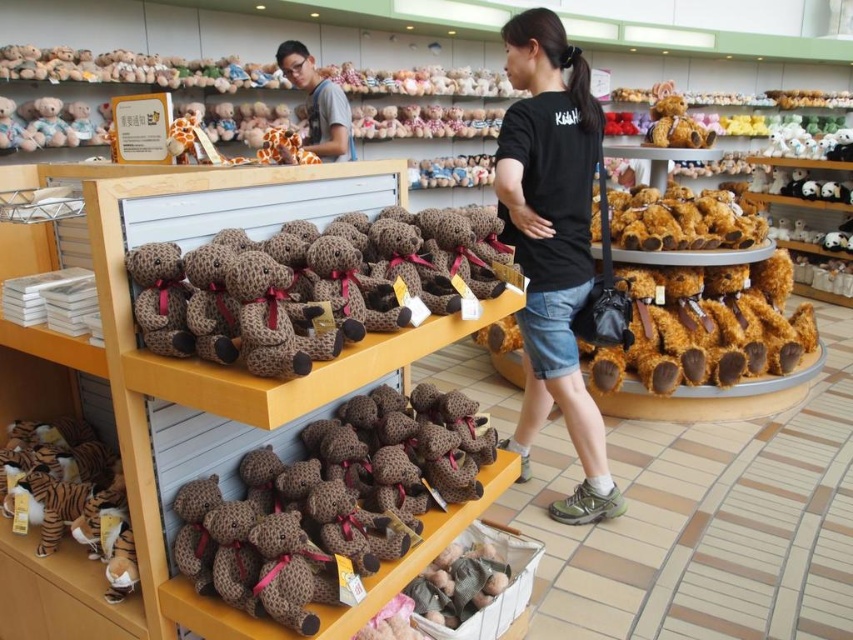
Is point (270, 490) farther from camera compared to point (540, 253)?

No, it is not.

Locate an element on the screen. This screenshot has width=853, height=640. brown plush bear at center is located at coordinates (329, 500).

At what (x,y) coordinates should I click in order to perform the action: click on brown plush bear at center. Please return your answer as a coordinate pair (x, y). This screenshot has width=853, height=640. Looking at the image, I should click on (329, 500).

Locate an element on the screen. brown plush bear at center is located at coordinates (329, 500).

Between brown plush bear at center and leopard print plush bear at center, which one has less height?

brown plush bear at center is shorter.

Locate an element on the screen. brown plush bear at center is located at coordinates (329, 500).

Locate an element on the screen. brown plush bear at center is located at coordinates (329, 500).

Between leopard print plush bear at center and black cotton t-shirt at center, which one has less height?

leopard print plush bear at center is shorter.

Does leopard print plush bear at center have a smaller size compared to black cotton t-shirt at center?

Correct, leopard print plush bear at center occupies less space than black cotton t-shirt at center.

Find the location of a particular element. leopard print plush bear at center is located at coordinates (323, 285).